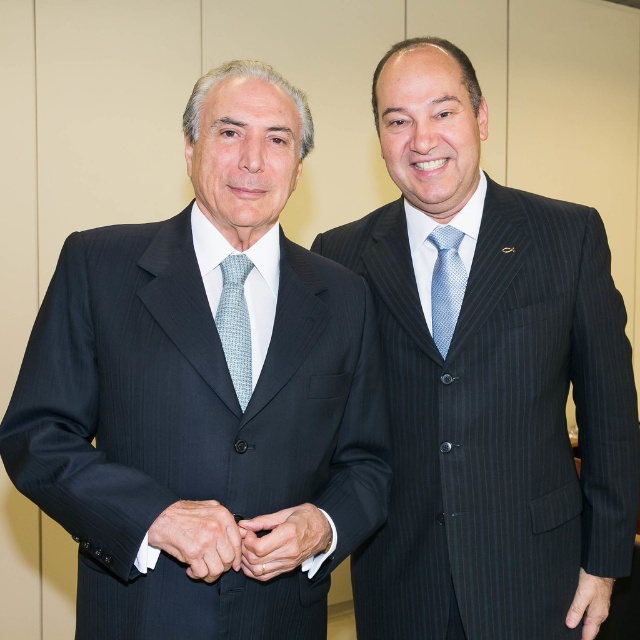
You are a photographer setting up for a portrait session. You need to place a small prop at a specific coordinate to frame the scene properly. The coordinates are given as a point between 0 and 1 in both x and y axes, where the origin is the bottom left corner of the image. You want to place the prop at point (202, 385). What object is located at that point?

The matte black suit at left is located at point (202, 385).

You are a photographer preparing to take a portrait of the two men in the image. You notice the smooth leather hand at center and the matte black suit at lower right. Which object should you focus on first if you want to capture the larger one in detail?

The smooth leather hand at center is larger in size than the matte black suit at lower right, so you should focus on the smooth leather hand at center first to capture the larger one in detail.